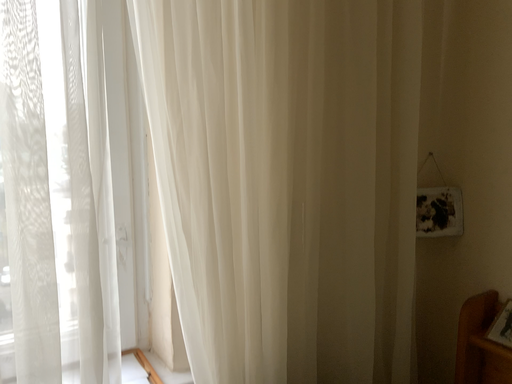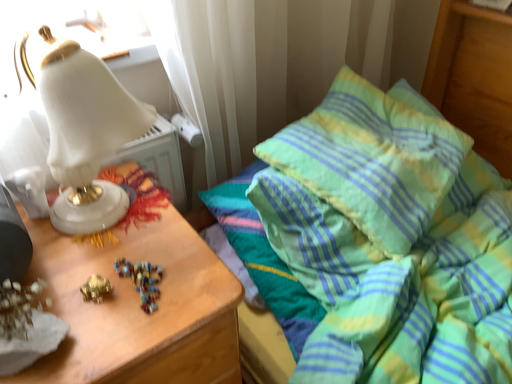
Question: Which way did the camera rotate in the video?

Choices:
 (A) rotated downward
 (B) rotated upward

Answer: (A)